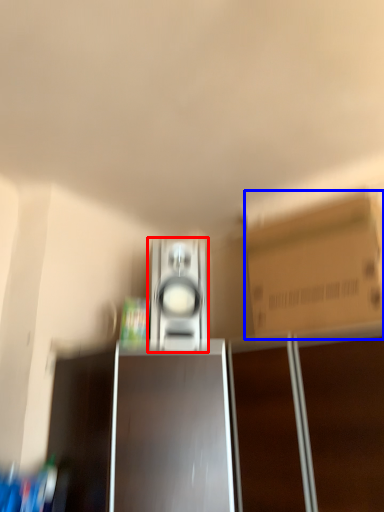
Question: Among these objects, which one is nearest to the camera, home appliance (highlighted by a red box) or cardboard box (highlighted by a blue box)?

Choices:
 (A) home appliance
 (B) cardboard box

Answer: (B)